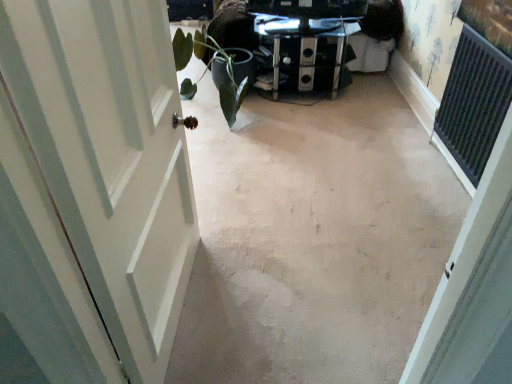
Question: From a real-world perspective, is beige carpet at center below green matte plant at left?

Choices:
 (A) yes
 (B) no

Answer: (A)

Question: Would you say beige carpet at center is a long distance from green matte plant at left?

Choices:
 (A) yes
 (B) no

Answer: (B)

Question: Does beige carpet at center have a lesser height compared to green matte plant at left?

Choices:
 (A) yes
 (B) no

Answer: (A)

Question: Is beige carpet at center wider than green matte plant at left?

Choices:
 (A) yes
 (B) no

Answer: (A)

Question: Does beige carpet at center have a lesser width compared to green matte plant at left?

Choices:
 (A) yes
 (B) no

Answer: (B)

Question: In terms of size, does beige carpet at center appear bigger or smaller than green matte plant at left?

Choices:
 (A) small
 (B) big

Answer: (B)

Question: Considering their positions, is beige carpet at center located in front of or behind green matte plant at left?

Choices:
 (A) front
 (B) behind

Answer: (A)

Question: From a real-world perspective, is beige carpet at center above or below green matte plant at left?

Choices:
 (A) above
 (B) below

Answer: (B)

Question: In the image, is beige carpet at center on the left side or the right side of green matte plant at left?

Choices:
 (A) left
 (B) right

Answer: (B)

Question: Would you say beige carpet at center is inside or outside white painted wood door at left?

Choices:
 (A) inside
 (B) outside

Answer: (B)

Question: In terms of height, does beige carpet at center look taller or shorter compared to white painted wood door at left?

Choices:
 (A) short
 (B) tall

Answer: (A)

Question: In the image, is beige carpet at center positioned in front of or behind white painted wood door at left?

Choices:
 (A) behind
 (B) front

Answer: (A)

Question: Considering the positions of point (188, 319) and point (24, 84), is point (188, 319) closer or farther from the camera than point (24, 84)?

Choices:
 (A) closer
 (B) farther

Answer: (B)

Question: Is metallic glass table at center spatially inside green matte plant at left, or outside of it?

Choices:
 (A) outside
 (B) inside

Answer: (A)

Question: Based on their sizes in the image, would you say metallic glass table at center is bigger or smaller than green matte plant at left?

Choices:
 (A) big
 (B) small

Answer: (B)